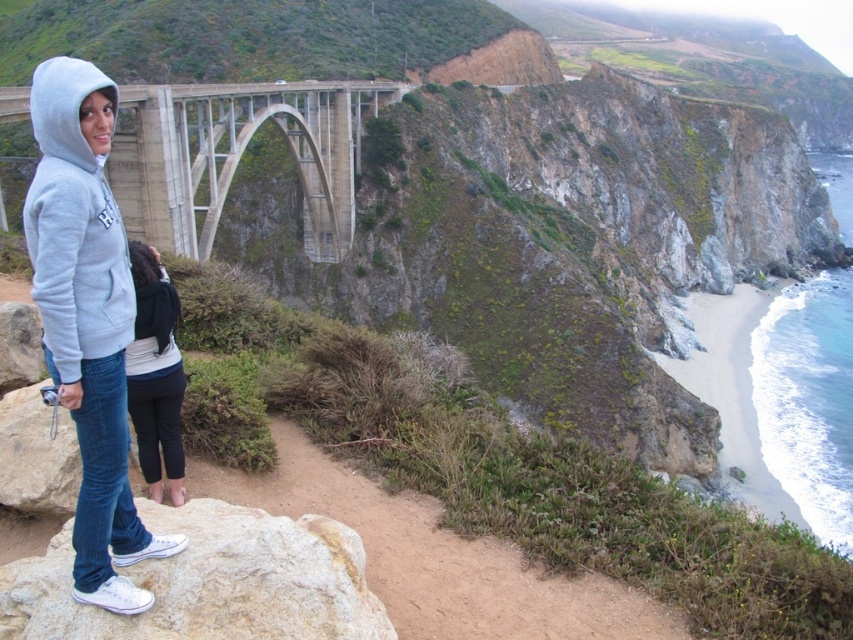
Question: Which point appears closest to the camera in this image?

Choices:
 (A) (57, 272)
 (B) (792, 515)

Answer: (A)

Question: Is gray fleece hoodie at left in front of black cotton pants at lower left?

Choices:
 (A) yes
 (B) no

Answer: (A)

Question: Can you confirm if concrete bridge at center is smaller than white sand beach at lower right?

Choices:
 (A) yes
 (B) no

Answer: (A)

Question: Which object appears closest to the camera in this image?

Choices:
 (A) smooth beige rock at lower left
 (B) light gray hoodie at center
 (C) white sand beach at lower right

Answer: (A)

Question: Which object appears closest to the camera in this image?

Choices:
 (A) light gray hoodie at center
 (B) smooth beige rock at lower left

Answer: (B)

Question: Is light gray hoodie at center smaller than concrete bridge at center?

Choices:
 (A) no
 (B) yes

Answer: (B)